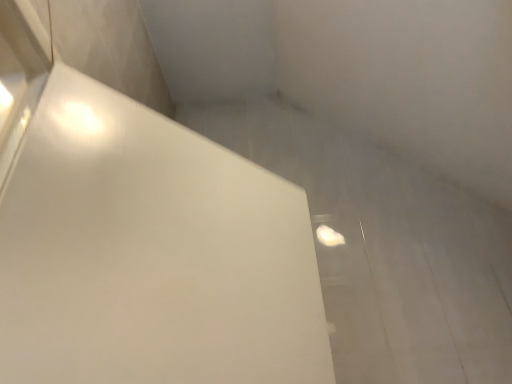
What is the approximate width of white glossy door at upper left?

3.68 inches.

At what (x,y) coordinates should I click in order to perform the action: click on white glossy door at upper left. Please return your answer as a coordinate pair (x, y). This screenshot has height=384, width=512. Looking at the image, I should click on (151, 254).

What do you see at coordinates (151, 254) in the screenshot? Image resolution: width=512 pixels, height=384 pixels. I see `white glossy door at upper left` at bounding box center [151, 254].

This screenshot has height=384, width=512. I want to click on white glossy door at upper left, so click(x=151, y=254).